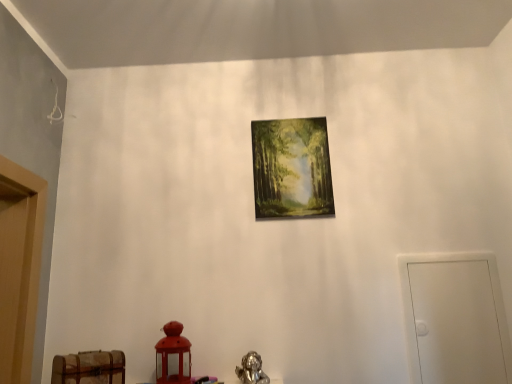
Question: Is white matte door at right in front of or behind matte wooden picture frame at center in the image?

Choices:
 (A) front
 (B) behind

Answer: (A)

Question: In terms of width, does white matte door at right look wider or thinner when compared to matte wooden picture frame at center?

Choices:
 (A) wide
 (B) thin

Answer: (A)

Question: Which of these objects is positioned farthest from the white matte door at right?

Choices:
 (A) wooden chest at lower left
 (B) matte wooden picture frame at center

Answer: (A)

Question: Which is farther from the white matte door at right?

Choices:
 (A) wooden chest at lower left
 (B) matte wooden picture frame at center

Answer: (A)